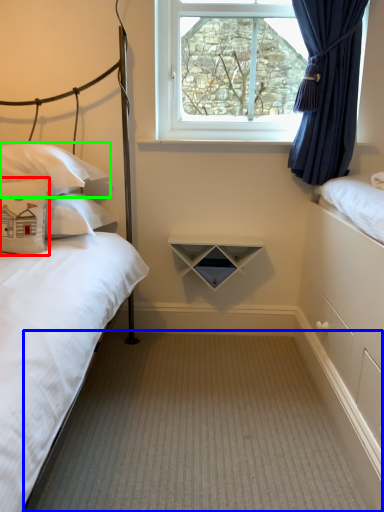
Question: Which object is the farthest from pillow (highlighted by a red box)? Choose among these: plain (highlighted by a blue box) or pillow (highlighted by a green box).

Choices:
 (A) plain
 (B) pillow

Answer: (A)